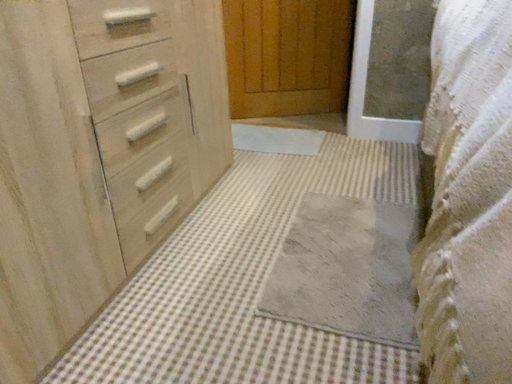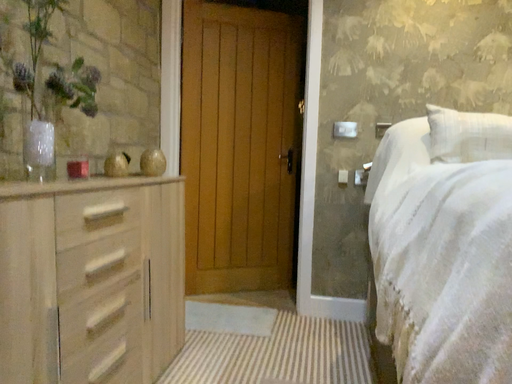
Question: Which way did the camera rotate in the video?

Choices:
 (A) rotated right
 (B) rotated left

Answer: (A)